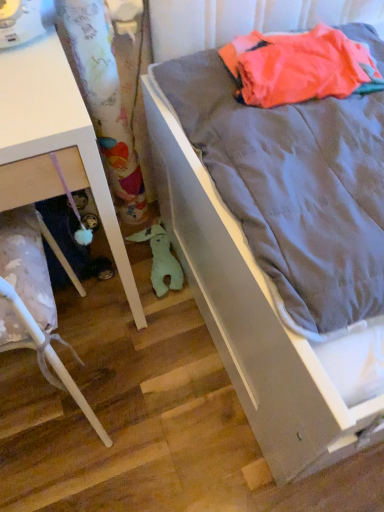
This screenshot has height=512, width=384. Find the location of `empty space that is to the right of white glossy drawer at lower left, which is counted as the first furniture, starting from the bottom`. empty space that is to the right of white glossy drawer at lower left, which is counted as the first furniture, starting from the bottom is located at coordinates (169, 394).